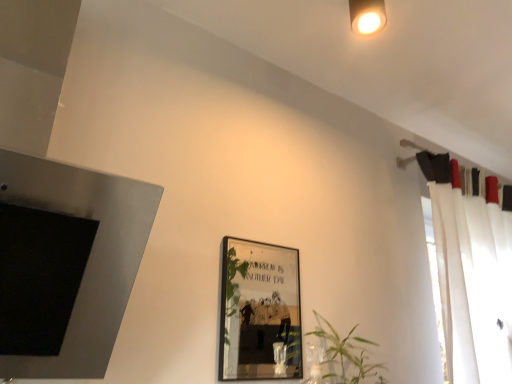
Question: From the image's perspective, is green leafy plant at center above metallic silver picture frame at center?

Choices:
 (A) yes
 (B) no

Answer: (B)

Question: Considering the relative sizes of green leafy plant at center and metallic silver picture frame at center in the image provided, is green leafy plant at center shorter than metallic silver picture frame at center?

Choices:
 (A) no
 (B) yes

Answer: (B)

Question: Is metallic silver picture frame at center surrounded by green leafy plant at center?

Choices:
 (A) yes
 (B) no

Answer: (B)

Question: From a real-world perspective, is green leafy plant at center over metallic silver picture frame at center?

Choices:
 (A) no
 (B) yes

Answer: (A)

Question: Does green leafy plant at center have a greater width compared to metallic silver picture frame at center?

Choices:
 (A) no
 (B) yes

Answer: (B)

Question: From the image's perspective, is matte black fireplace at left located above or below green leafy plant at center?

Choices:
 (A) below
 (B) above

Answer: (B)

Question: Considering the positions of point (94, 344) and point (382, 367), is point (94, 344) closer or farther from the camera than point (382, 367)?

Choices:
 (A) closer
 (B) farther

Answer: (A)

Question: From a real-world perspective, is matte black fireplace at left above or below green leafy plant at center?

Choices:
 (A) below
 (B) above

Answer: (B)

Question: In terms of height, does matte black fireplace at left look taller or shorter compared to green leafy plant at center?

Choices:
 (A) short
 (B) tall

Answer: (B)

Question: From the image's perspective, is matte black fireplace at left positioned above or below white sheer curtain at right?

Choices:
 (A) above
 (B) below

Answer: (A)

Question: Considering their positions, is matte black fireplace at left located in front of or behind white sheer curtain at right?

Choices:
 (A) front
 (B) behind

Answer: (A)

Question: Considering the positions of matte black fireplace at left and white sheer curtain at right in the image, is matte black fireplace at left bigger or smaller than white sheer curtain at right?

Choices:
 (A) big
 (B) small

Answer: (B)

Question: Is matte black fireplace at left inside or outside of white sheer curtain at right?

Choices:
 (A) outside
 (B) inside

Answer: (A)

Question: Relative to matte black fireplace at left, is white sheer curtain at right in front or behind?

Choices:
 (A) behind
 (B) front

Answer: (A)

Question: Based on their sizes in the image, would you say white sheer curtain at right is bigger or smaller than matte black fireplace at left?

Choices:
 (A) big
 (B) small

Answer: (A)